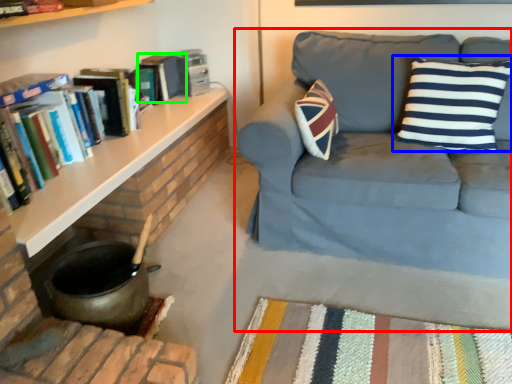
Question: Which object is positioned closest to studio couch (highlighted by a red box)? Select from pillow (highlighted by a blue box) and paperback book (highlighted by a green box).

Choices:
 (A) pillow
 (B) paperback book

Answer: (A)